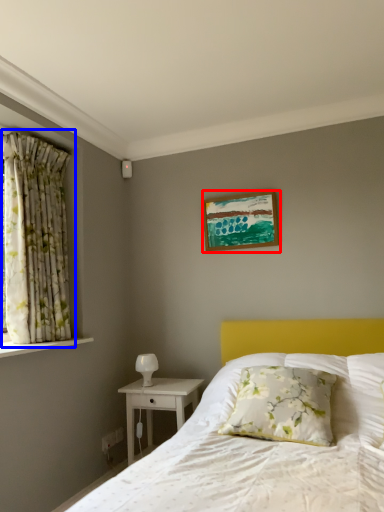
Question: Which object appears farthest to the camera in this image, picture frame (highlighted by a red box) or curtain (highlighted by a blue box)?

Choices:
 (A) picture frame
 (B) curtain

Answer: (A)